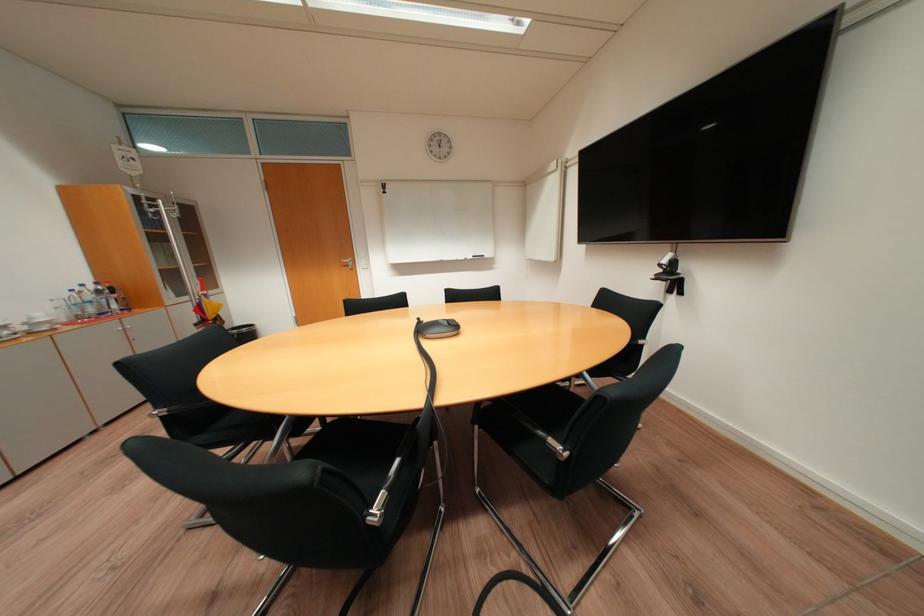
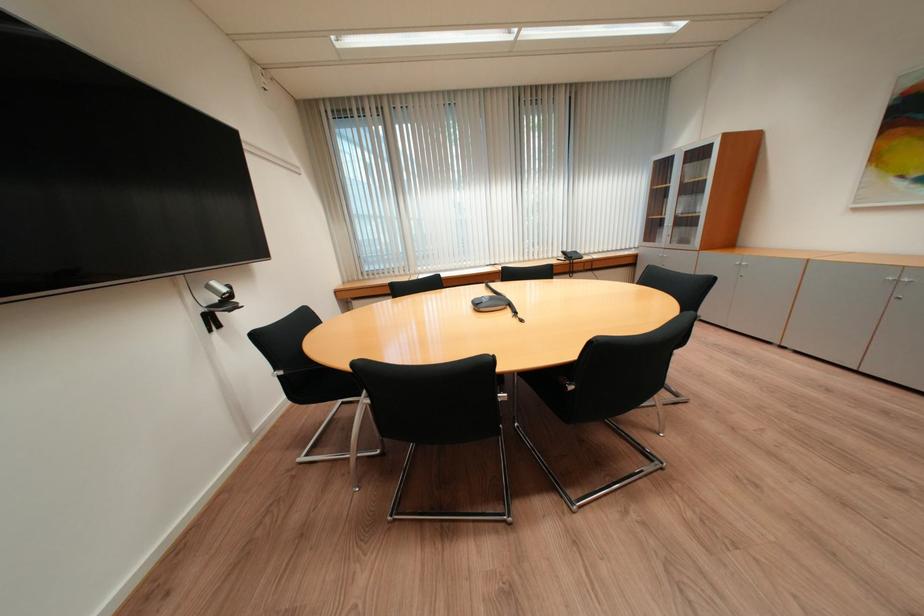
Question: I am providing you with two images of the same scene from different viewpoints. Which of the following objects are not visible in image2?

Choices:
 (A) cabinet handle cutout
 (B) metallic chair armrest
 (C) conference phone
 (D) silver web camera

Answer: (B)